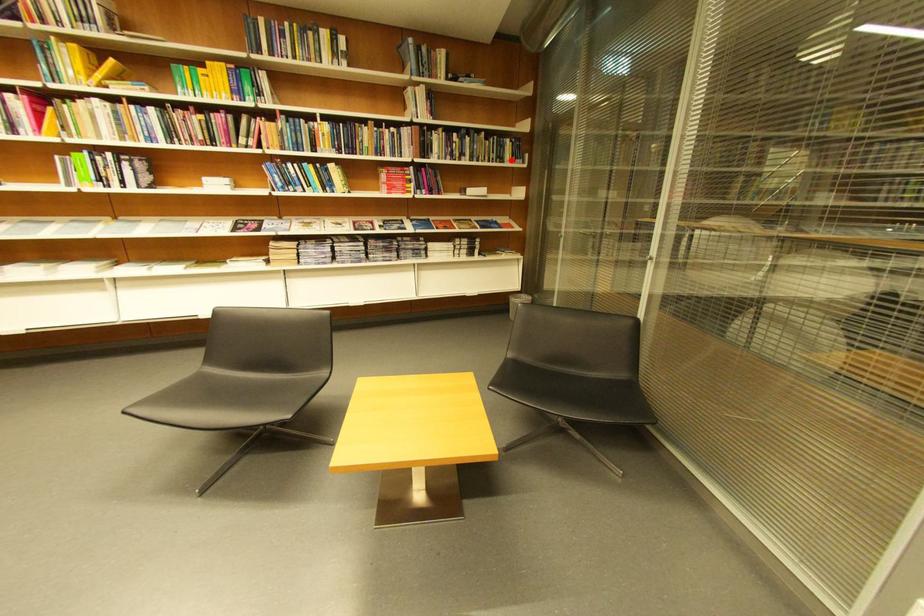
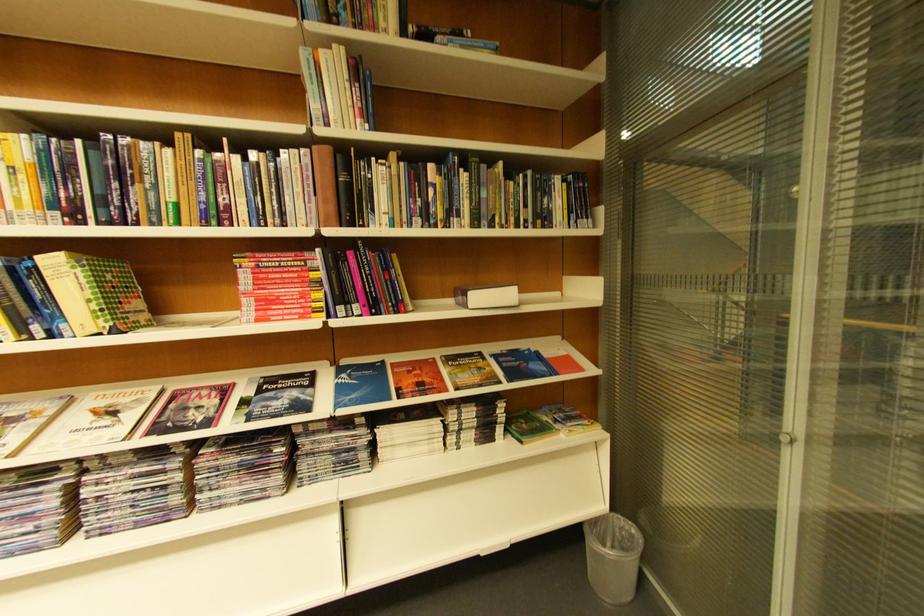
Find the pixel in the second image that matches the highlighted location in the first image.

(554, 221)